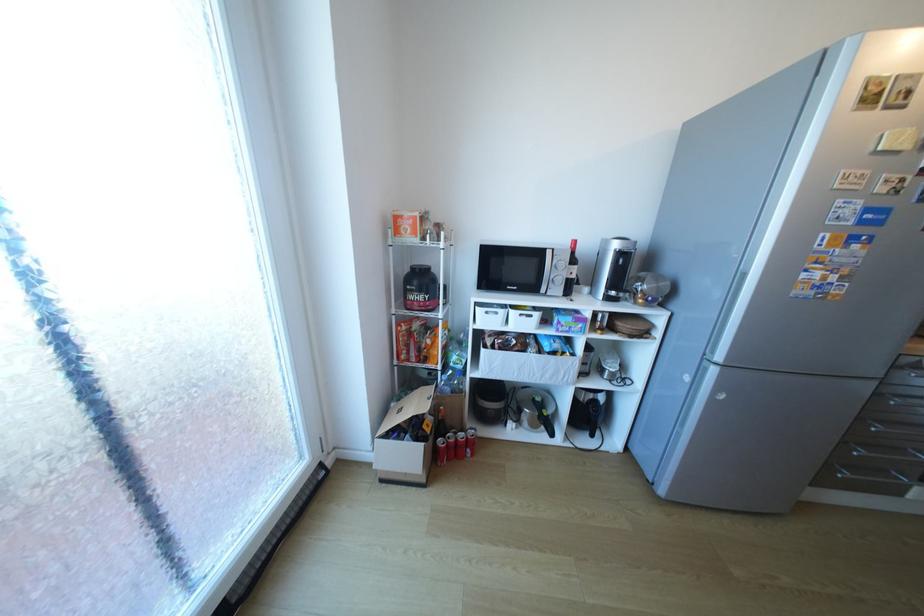
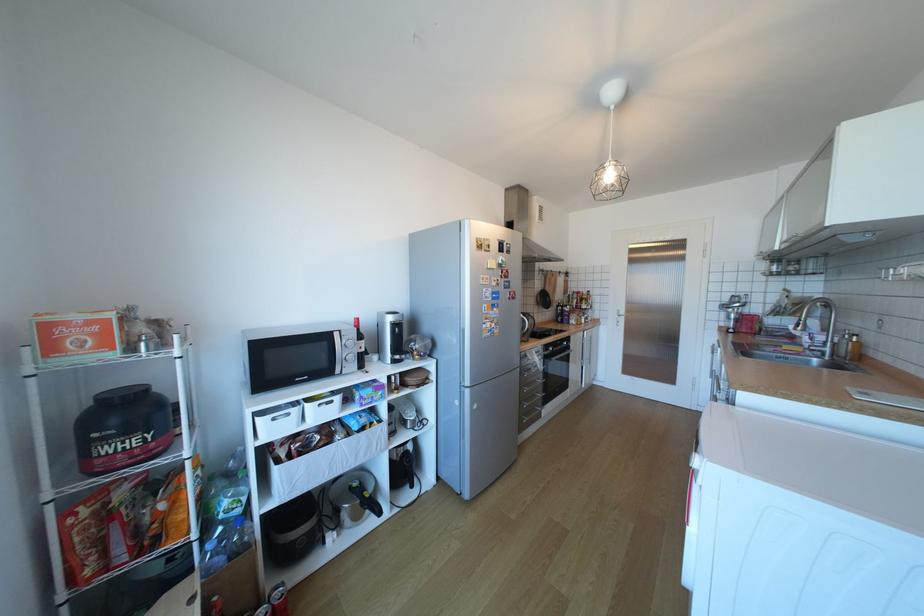
Find the pixel in the second image that matches pixel 495 313 in the first image.

(283, 419)